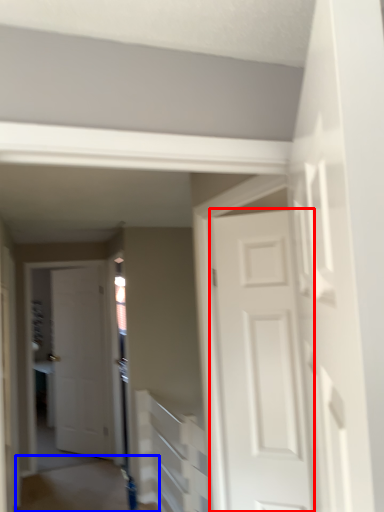
Question: Which object is closer to the camera taking this photo, door (highlighted by a red box) or path (highlighted by a blue box)?

Choices:
 (A) door
 (B) path

Answer: (A)